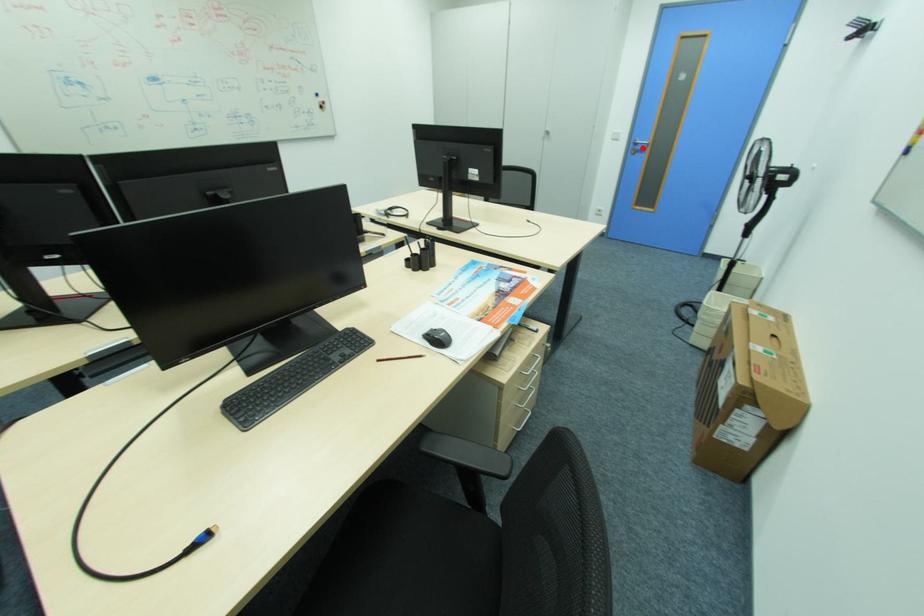
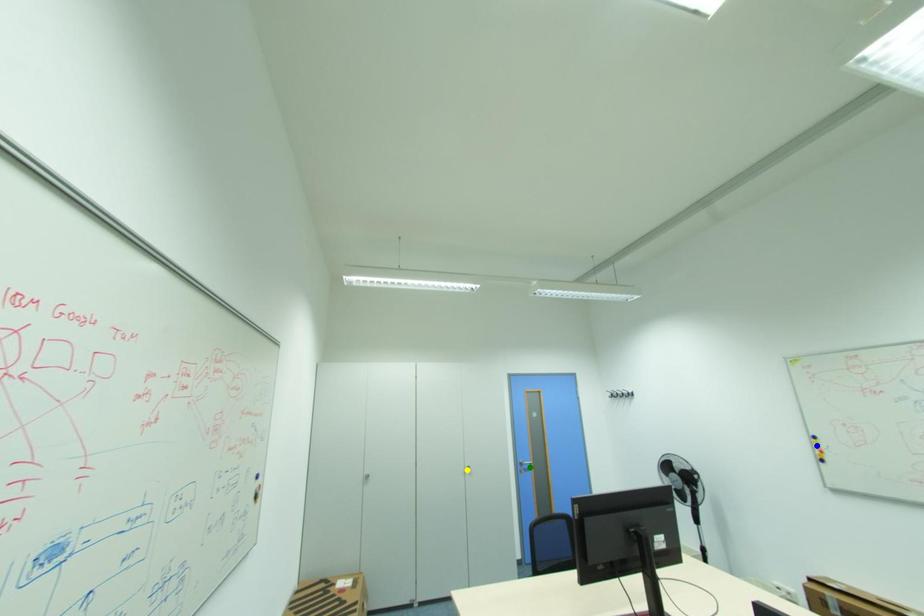
Question: I am providing you with two images of the same scene from different viewpoints. A red point is marked on the first image. You are given multiple points on the second image. Which point in image 2 represents the same 3d spot as the red point in image 1?

Choices:
 (A) yellow point
 (B) blue point
 (C) green point

Answer: (C)